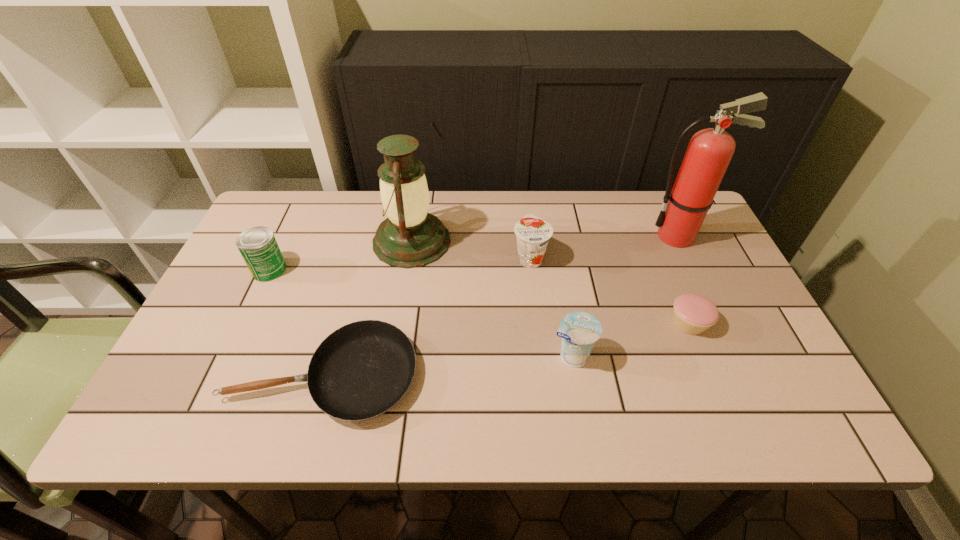
In order to click on frying pan located in the left edge section of the desktop in this screenshot , I will do `click(361, 370)`.

You are a GUI agent. You are given a task and a screenshot of the screen. Output one action in this format:
    pyautogui.click(x=<x>, y=<y>)
    Task: Click on the fire extinguisher that is positioned at the right edge
    This screenshot has width=960, height=540.
    Given the screenshot: What is the action you would take?
    pyautogui.click(x=709, y=152)

Find the location of a particular element. The height and width of the screenshot is (540, 960). cupcake located in the right edge section of the desktop is located at coordinates (693, 314).

Locate an element on the screen. object positioned at the near left corner is located at coordinates (361, 370).

I want to click on object at the far right corner, so click(x=709, y=152).

Where is `vacant space at the far edge of the desktop`? vacant space at the far edge of the desktop is located at coordinates (481, 200).

Where is `vacant space at the near edge of the desktop`? vacant space at the near edge of the desktop is located at coordinates (711, 395).

Where is `vacant position at the left edge of the desktop`? Image resolution: width=960 pixels, height=540 pixels. vacant position at the left edge of the desktop is located at coordinates (300, 251).

The width and height of the screenshot is (960, 540). I want to click on vacant space at the right edge of the desktop, so pos(732,342).

I want to click on vacant space at the far left corner of the desktop, so click(x=302, y=210).